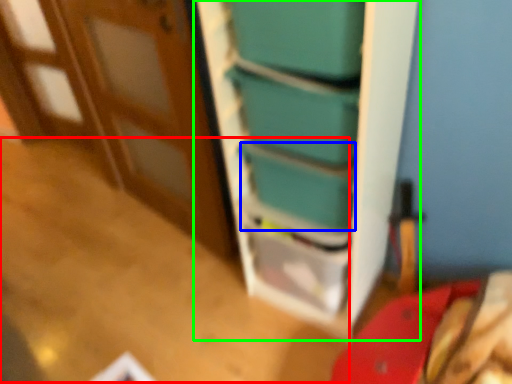
Question: Considering the real-world distances, which object is farthest from table (highlighted by a red box)? box (highlighted by a blue box) or bookshelf (highlighted by a green box)?

Choices:
 (A) box
 (B) bookshelf

Answer: (A)